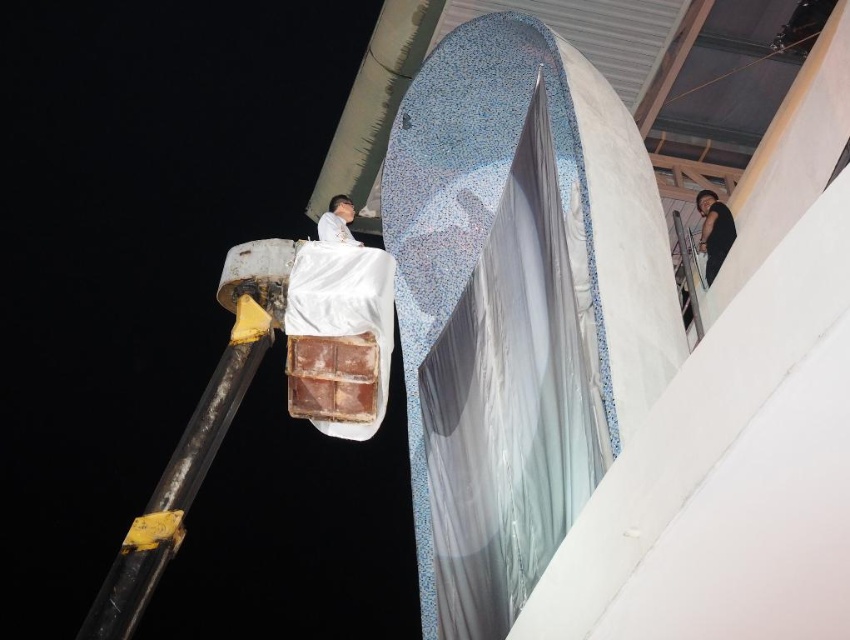
Is black matte shirt at upper right smaller than matte white shirt at upper center?

No.

I want to click on black matte shirt at upper right, so click(714, 230).